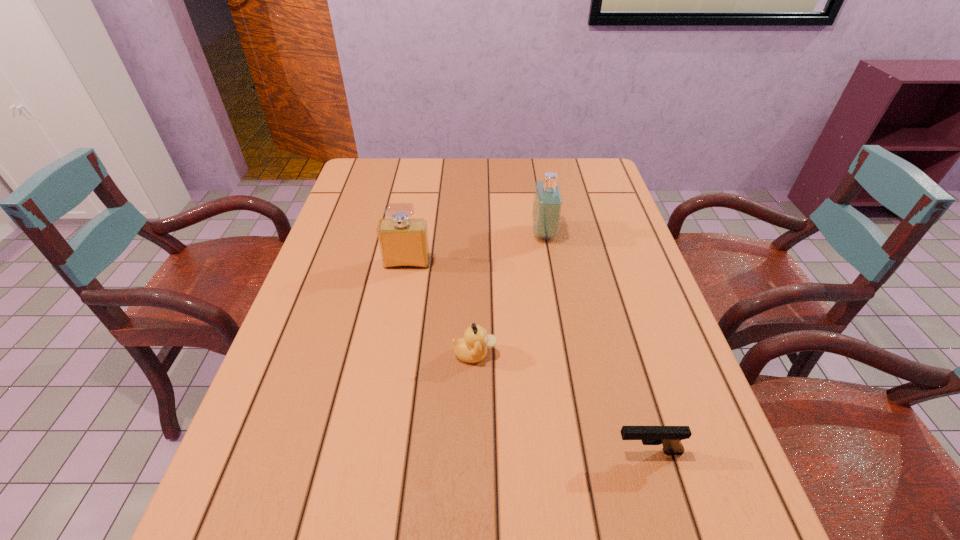
This screenshot has width=960, height=540. I want to click on free space located on the front label of the right perfume, so click(459, 233).

At what (x,y) coordinates should I click in order to perform the action: click on free point located on the front-facing side of the nearer perfume. Please return your answer as a coordinate pair (x, y). Image resolution: width=960 pixels, height=540 pixels. Looking at the image, I should click on (387, 376).

At what (x,y) coordinates should I click in order to perform the action: click on free space located on the face of the second nearest object. Please return your answer as a coordinate pair (x, y). Looking at the image, I should click on (657, 354).

Find the location of a particular element. The width and height of the screenshot is (960, 540). vacant space located 0.220m on the front-facing side of the nearest object is located at coordinates (492, 451).

The width and height of the screenshot is (960, 540). Identify the location of vacant space located 0.270m on the front-facing side of the nearest object. (464, 451).

Identify the location of free region located 0.340m on the front-facing side of the nearest object. (425, 451).

Locate an element on the screen. The height and width of the screenshot is (540, 960). object that is positioned at the right edge is located at coordinates (670, 437).

You are a GUI agent. You are given a task and a screenshot of the screen. Output one action in this format:
    pyautogui.click(x=<x>, y=<y>)
    Task: Click on the vacant space at the far edge of the desktop
    The width and height of the screenshot is (960, 540).
    Given the screenshot: What is the action you would take?
    pyautogui.click(x=507, y=176)

In the image, there is a desktop. Find the location of `vacant space at the near edge`. vacant space at the near edge is located at coordinates (547, 532).

Find the location of a particular element. The image size is (960, 540). vacant space at the left edge of the desktop is located at coordinates (350, 241).